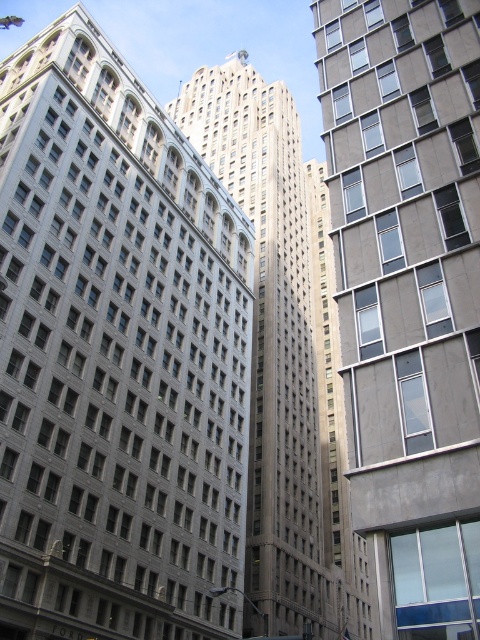
Does gray stone building at center appear under gray stone skyscraper at center?

Correct, gray stone building at center is located below gray stone skyscraper at center.

Does gray stone building at center have a lesser width compared to gray stone skyscraper at center?

Indeed, gray stone building at center has a lesser width compared to gray stone skyscraper at center.

Where is `gray stone building at center`? This screenshot has height=640, width=480. gray stone building at center is located at coordinates (116, 356).

Identify the location of gray stone building at center. (116, 356).

How distant is gray concrete building at right from gray stone skyscraper at center?

gray concrete building at right is 213.52 feet from gray stone skyscraper at center.

Measure the distance between gray concrete building at right and camera.

gray concrete building at right is 21.65 meters from camera.

Is point (430, 337) positioned in front of point (303, 432)?

Yes, it is in front of point (303, 432).

Where is `gray concrete building at right`? gray concrete building at right is located at coordinates (408, 294).

Which of these two, gray stone building at center or gray concrete building at right, stands taller?

gray stone building at center is taller.

Does gray stone building at center appear under gray concrete building at right?

Yes.

Between point (190, 531) and point (407, 154), which one is positioned in front?

Point (407, 154) is more forward.

Identify the location of gray stone building at center. (116, 356).